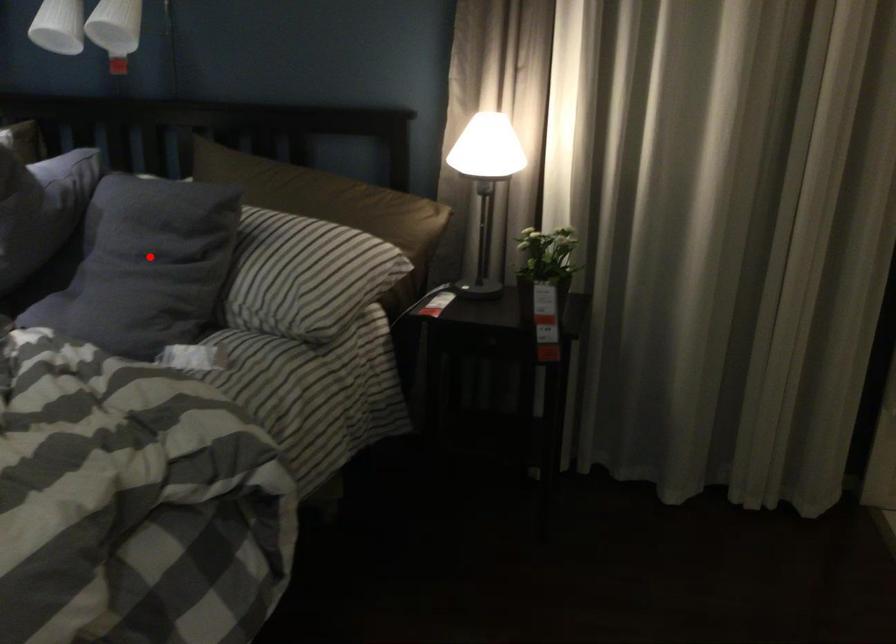
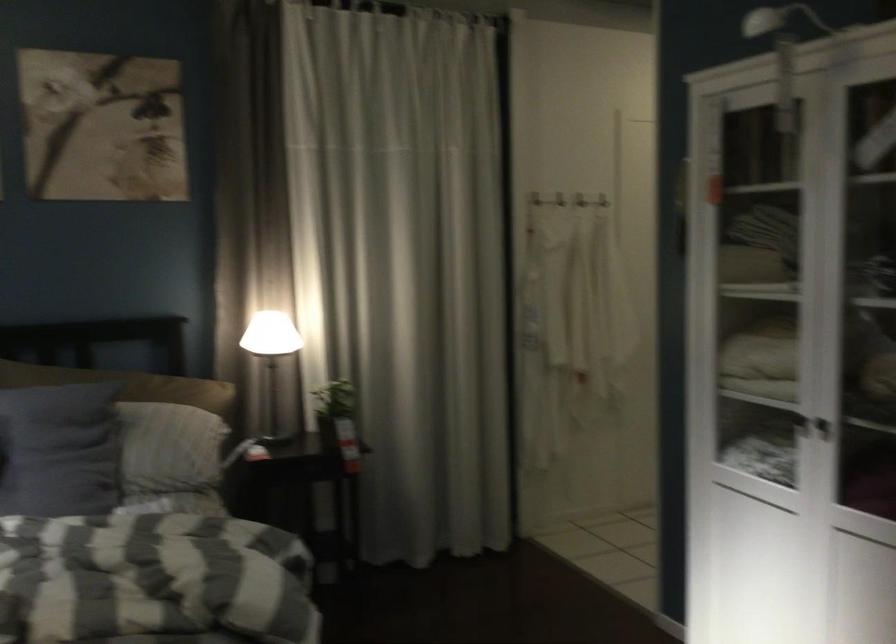
The point at the highlighted location is marked in the first image. Where is the corresponding point in the second image?

(58, 450)